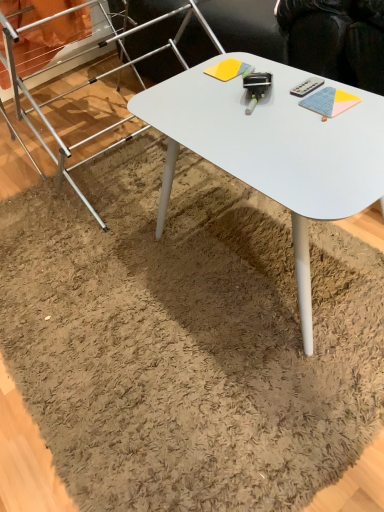
Question: Can you confirm if silver metallic ladder at upper left is bigger than white matte desk at center?

Choices:
 (A) no
 (B) yes

Answer: (B)

Question: Is silver metallic ladder at upper left further to the viewer compared to white matte desk at center?

Choices:
 (A) no
 (B) yes

Answer: (B)

Question: Is silver metallic ladder at upper left with white matte desk at center?

Choices:
 (A) yes
 (B) no

Answer: (B)

Question: Is silver metallic ladder at upper left not within white matte desk at center?

Choices:
 (A) yes
 (B) no

Answer: (A)

Question: From a real-world perspective, does silver metallic ladder at upper left stand above white matte desk at center?

Choices:
 (A) yes
 (B) no

Answer: (A)

Question: From the image's perspective, is yellow matte notepad at center, marked as the first notepad in a top-to-bottom arrangement, above or below textured blue notepad at upper right, acting as the first notepad starting from the right?

Choices:
 (A) below
 (B) above

Answer: (B)

Question: From a real-world perspective, is yellow matte notepad at center, arranged as the 2th notepad when ordered from the bottom, positioned above or below textured blue notepad at upper right, marked as the 2th notepad in a left-to-right arrangement?

Choices:
 (A) below
 (B) above

Answer: (A)

Question: Based on their positions, is yellow matte notepad at center, marked as the first notepad in a top-to-bottom arrangement, located to the left or right of textured blue notepad at upper right, marked as the 2th notepad in a left-to-right arrangement?

Choices:
 (A) left
 (B) right

Answer: (A)

Question: Considering the positions of yellow matte notepad at center, the second notepad in the right-to-left sequence, and textured blue notepad at upper right, the second notepad in the top-to-bottom sequence, in the image, is yellow matte notepad at center, the second notepad in the right-to-left sequence, wider or thinner than textured blue notepad at upper right, the second notepad in the top-to-bottom sequence,?

Choices:
 (A) wide
 (B) thin

Answer: (A)

Question: In terms of height, does textured blue notepad at upper right, the 1th notepad when ordered from bottom to top, look taller or shorter compared to yellow matte notepad at center, the second notepad in the right-to-left sequence?

Choices:
 (A) short
 (B) tall

Answer: (A)

Question: Based on their positions, is textured blue notepad at upper right, acting as the first notepad starting from the right, located to the left or right of yellow matte notepad at center, marked as the first notepad in a top-to-bottom arrangement?

Choices:
 (A) right
 (B) left

Answer: (A)

Question: From the image's perspective, relative to yellow matte notepad at center, the first notepad when ordered from back to front, is textured blue notepad at upper right, the 1th notepad when ordered from bottom to top, above or below?

Choices:
 (A) above
 (B) below

Answer: (B)

Question: Looking at the image, does textured blue notepad at upper right, the 1th notepad when ordered from bottom to top, seem bigger or smaller compared to yellow matte notepad at center, the first notepad when ordered from back to front?

Choices:
 (A) big
 (B) small

Answer: (B)

Question: Is yellow matte notepad at center, marked as the first notepad in a top-to-bottom arrangement, wider or thinner than black plastic remote control at upper right?

Choices:
 (A) thin
 (B) wide

Answer: (B)

Question: In terms of height, does yellow matte notepad at center, marked as the first notepad in a top-to-bottom arrangement, look taller or shorter compared to black plastic remote control at upper right?

Choices:
 (A) tall
 (B) short

Answer: (A)